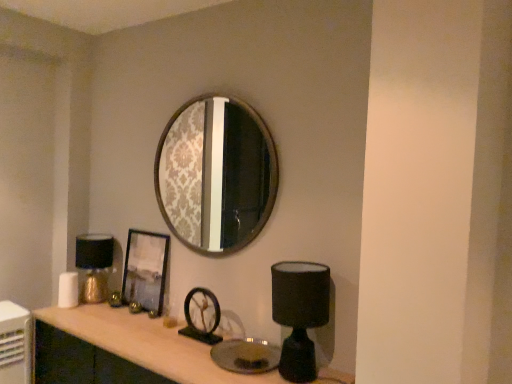
Identify the location of free space in front of metallic silver picture frame at center. This screenshot has width=512, height=384. (124, 325).